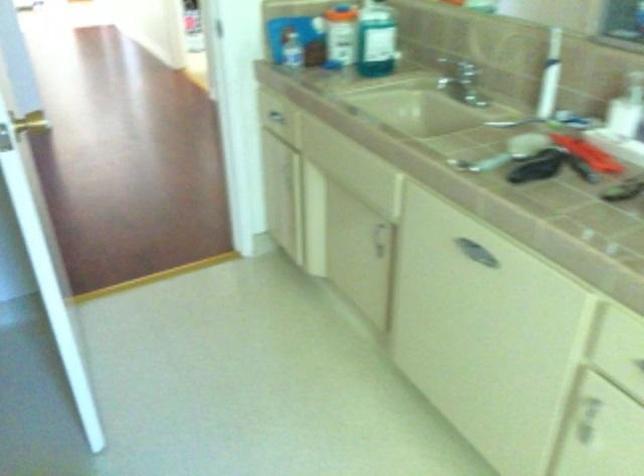
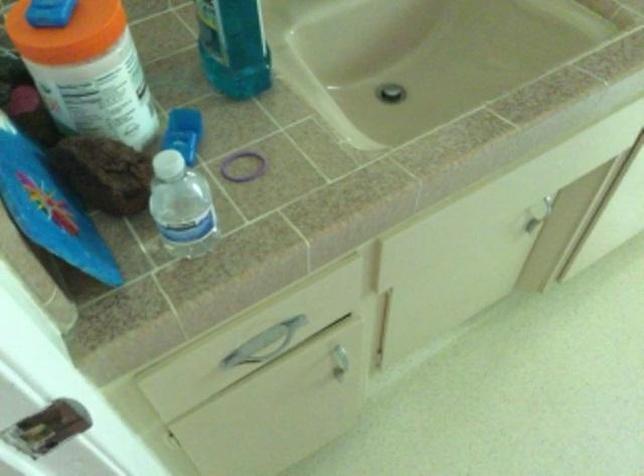
The point at (308, 192) is marked in the first image. Where is the corresponding point in the second image?

(339, 357)